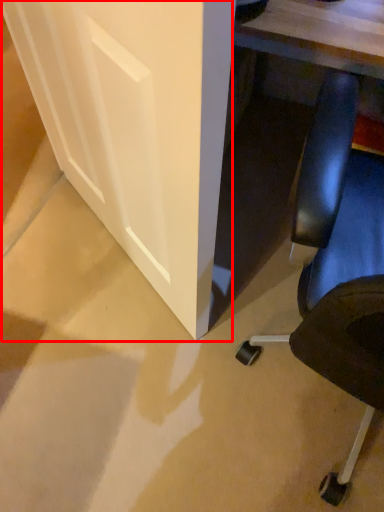
Question: Observing the image, what is the correct spatial positioning of glass door (annotated by the red box) in reference to chair?

Choices:
 (A) left
 (B) right

Answer: (A)